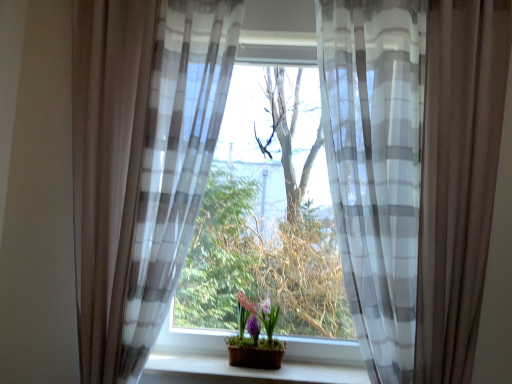
This screenshot has width=512, height=384. Identify the location of matte purple pot at center. (256, 336).

I want to click on sheer gray-white striped curtain at left, which appears as the second curtain when viewed from the right, so click(141, 162).

Find the location of a particular element. Image resolution: width=512 pixels, height=384 pixels. translucent fabric at center is located at coordinates (267, 212).

Does sheer gray-white striped curtain at left, which appears as the second curtain when viewed from the right, lie in front of translucent fabric at center?

Yes, sheer gray-white striped curtain at left, which appears as the second curtain when viewed from the right, is in front of translucent fabric at center.

Where is `window on the right of sheer gray-white striped curtain at left, the 1th curtain when ordered from left to right`? This screenshot has height=384, width=512. window on the right of sheer gray-white striped curtain at left, the 1th curtain when ordered from left to right is located at coordinates (267, 212).

In the scene shown: Is sheer gray-white striped curtain at left, the 1th curtain when ordered from left to right, positioned with its back to translucent fabric at center?

Absolutely, sheer gray-white striped curtain at left, the 1th curtain when ordered from left to right, is directed away from translucent fabric at center.

Measure the distance from sheer white and gray striped curtain at center, which is the first curtain in right-to-left order, to wooden at center.

sheer white and gray striped curtain at center, which is the first curtain in right-to-left order, is 37.05 inches away from wooden at center.

From a real-world perspective, is sheer white and gray striped curtain at center, which is the first curtain in right-to-left order, physically below wooden at center?

Incorrect, from a real-world perspective, sheer white and gray striped curtain at center, which is the first curtain in right-to-left order, is higher than wooden at center.

Consider the image. From the image's perspective, is sheer white and gray striped curtain at center, marked as the 2th curtain in a left-to-right arrangement, located above wooden at center?

Yes, from the image's perspective, sheer white and gray striped curtain at center, marked as the 2th curtain in a left-to-right arrangement, is over wooden at center.

Is the depth of sheer white and gray striped curtain at center, marked as the 2th curtain in a left-to-right arrangement, less than that of wooden at center?

That is True.

Which is more distant, (254,367) or (212,163)?

The point (212,163) is farther from the camera.

Is matte purple pot at center smaller than translucent fabric at center?

Indeed, matte purple pot at center has a smaller size compared to translucent fabric at center.

In the scene shown: Considering the relative positions of matte purple pot at center and translucent fabric at center in the image provided, is matte purple pot at center to the left of translucent fabric at center from the viewer's perspective?

Yes.

The width and height of the screenshot is (512, 384). Find the location of `houseplant below the translucent fabric at center (from the image's perspective)`. houseplant below the translucent fabric at center (from the image's perspective) is located at coordinates (256, 336).

Which is more distant, (240, 238) or (301, 382)?

The point (240, 238) is farther.

Consider the image. Which object is thinner, translucent fabric at center or wooden at center?

With smaller width is wooden at center.

Can you tell me how much translucent fabric at center and wooden at center differ in facing direction?

There is a 0.000471-degree angle between the facing directions of translucent fabric at center and wooden at center.

In the scene shown: Is sheer white and gray striped curtain at center, which is the first curtain in right-to-left order, located within matte purple pot at center?

Definitely not — sheer white and gray striped curtain at center, which is the first curtain in right-to-left order, is not inside matte purple pot at center.

Which object is further away from the camera, matte purple pot at center or sheer white and gray striped curtain at center, marked as the 2th curtain in a left-to-right arrangement?

matte purple pot at center is further away from the camera.

From the image's perspective, is matte purple pot at center on top of sheer white and gray striped curtain at center, which is the first curtain in right-to-left order?

No, from the image's perspective, matte purple pot at center is not on top of sheer white and gray striped curtain at center, which is the first curtain in right-to-left order.

Can you confirm if translucent fabric at center is taller than sheer white and gray striped curtain at center, which is the first curtain in right-to-left order?

In fact, translucent fabric at center may be shorter than sheer white and gray striped curtain at center, which is the first curtain in right-to-left order.

Does translucent fabric at center appear on the right side of sheer white and gray striped curtain at center, which is the first curtain in right-to-left order?

No, translucent fabric at center is not to the right of sheer white and gray striped curtain at center, which is the first curtain in right-to-left order.

From the image's perspective, is translucent fabric at center located above sheer white and gray striped curtain at center, marked as the 2th curtain in a left-to-right arrangement?

No.

In order to click on window sill in front of the matte purple pot at center in this screenshot , I will do `click(242, 372)`.

Is matte purple pot at center oriented away from wooden at center?

matte purple pot at center does not have its back to wooden at center.

Which is less distant, (274, 369) or (261, 371)?

The point (261, 371) is closer to the camera.

Which is more to the left, matte purple pot at center or wooden at center?

wooden at center.

The image size is (512, 384). In the image, there is a sheer gray-white striped curtain at left, the 1th curtain when ordered from left to right. What are the coordinates of `window below it (from the image's perspective)` in the screenshot? It's located at (267, 212).

Where is `curtain that is the 2nd one above the wooden at center (from a real-world perspective)`? curtain that is the 2nd one above the wooden at center (from a real-world perspective) is located at coordinates (413, 172).

Based on their spatial positions, is translucent fabric at center or matte purple pot at center further from sheer white and gray striped curtain at center, which is the first curtain in right-to-left order?

matte purple pot at center lies further to sheer white and gray striped curtain at center, which is the first curtain in right-to-left order, than the other object.

Estimate the real-world distances between objects in this image. Which object is closer to matte purple pot at center, sheer white and gray striped curtain at center, which is the first curtain in right-to-left order, or wooden at center?

wooden at center is closer to matte purple pot at center.

From the picture: Which object lies nearer to the anchor point sheer gray-white striped curtain at left, the 1th curtain when ordered from left to right, wooden at center or translucent fabric at center?

translucent fabric at center is closer to sheer gray-white striped curtain at left, the 1th curtain when ordered from left to right.

From the image, which object appears to be farther from matte purple pot at center, sheer white and gray striped curtain at center, marked as the 2th curtain in a left-to-right arrangement, or translucent fabric at center?

sheer white and gray striped curtain at center, marked as the 2th curtain in a left-to-right arrangement, lies further to matte purple pot at center than the other object.

Estimate the real-world distances between objects in this image. Which object is closer to sheer gray-white striped curtain at left, the 1th curtain when ordered from left to right, translucent fabric at center or sheer white and gray striped curtain at center, which is the first curtain in right-to-left order?

translucent fabric at center.

In the scene shown: Which object lies further to the anchor point translucent fabric at center, matte purple pot at center or sheer gray-white striped curtain at left, the 1th curtain when ordered from left to right?

Based on the image, sheer gray-white striped curtain at left, the 1th curtain when ordered from left to right, appears to be further to translucent fabric at center.

Considering their positions, is translucent fabric at center positioned closer to matte purple pot at center than wooden at center?

Among the two, wooden at center is located nearer to matte purple pot at center.

Considering their positions, is sheer white and gray striped curtain at center, which is the first curtain in right-to-left order, positioned closer to sheer gray-white striped curtain at left, which appears as the second curtain when viewed from the right, than matte purple pot at center?

matte purple pot at center lies closer to sheer gray-white striped curtain at left, which appears as the second curtain when viewed from the right, than the other object.

What are the coordinates of `window between sheer gray-white striped curtain at left, the 1th curtain when ordered from left to right, and matte purple pot at center in the up-down direction` in the screenshot? It's located at (267, 212).

Where is `houseplant between sheer white and gray striped curtain at center, marked as the 2th curtain in a left-to-right arrangement, and wooden at center, in the vertical direction`? houseplant between sheer white and gray striped curtain at center, marked as the 2th curtain in a left-to-right arrangement, and wooden at center, in the vertical direction is located at coordinates (256, 336).

At what (x,y) coordinates should I click in order to perform the action: click on window located between sheer gray-white striped curtain at left, the 1th curtain when ordered from left to right, and sheer white and gray striped curtain at center, which is the first curtain in right-to-left order, in the left-right direction. Please return your answer as a coordinate pair (x, y). Image resolution: width=512 pixels, height=384 pixels. Looking at the image, I should click on (267, 212).

This screenshot has height=384, width=512. Identify the location of houseplant located between sheer gray-white striped curtain at left, the 1th curtain when ordered from left to right, and sheer white and gray striped curtain at center, marked as the 2th curtain in a left-to-right arrangement, in the left-right direction. (256, 336).